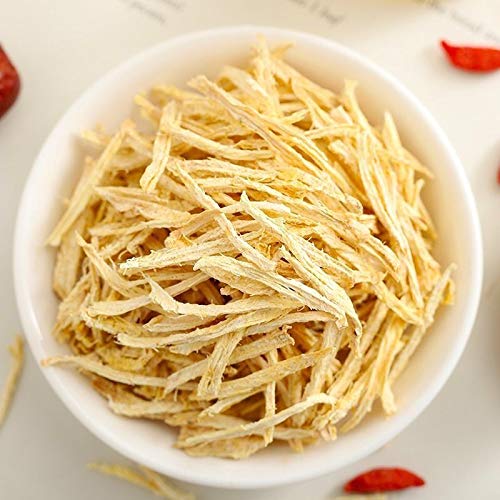
This screenshot has width=500, height=500. What are the coordinates of `rim of bowl` in the screenshot? It's located at (459, 167), (78, 416), (84, 93), (428, 401).